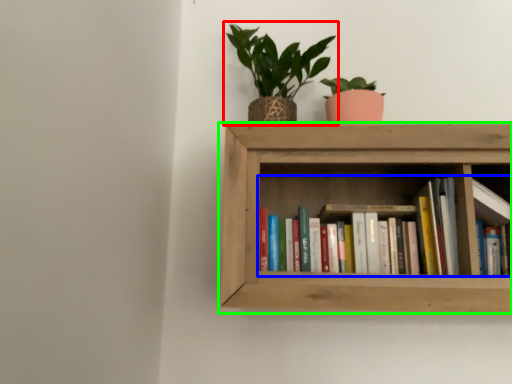
Question: Which object is positioned farthest from houseplant (highlighted by a red box)? Select from book (highlighted by a blue box) and shelf (highlighted by a green box).

Choices:
 (A) book
 (B) shelf

Answer: (A)